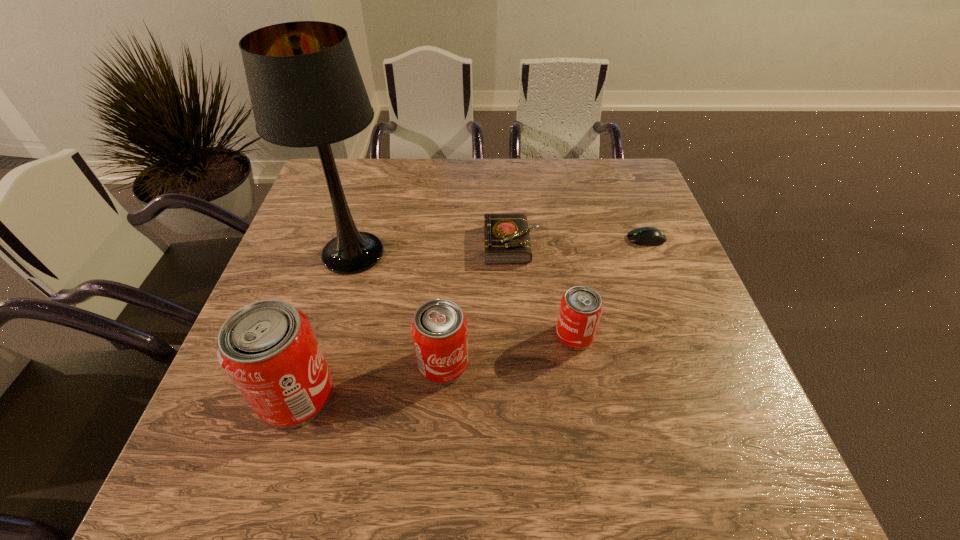
This screenshot has height=540, width=960. What are the coordinates of `free space that satisfies the following two spatial constraints: 1. on the front side of the table lamp; 2. on the left side of the second can from left to right` in the screenshot? It's located at (321, 363).

Where is `vacant position in the image that satisfies the following two spatial constraints: 1. on the back side of the fifth tallest object; 2. on the left side of the table lamp`? vacant position in the image that satisfies the following two spatial constraints: 1. on the back side of the fifth tallest object; 2. on the left side of the table lamp is located at coordinates (356, 245).